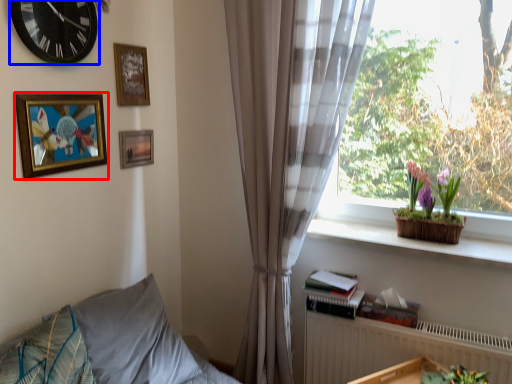
Question: Which object appears closest to the camera in this image, picture frame (highlighted by a red box) or wall clock (highlighted by a blue box)?

Choices:
 (A) picture frame
 (B) wall clock

Answer: (B)